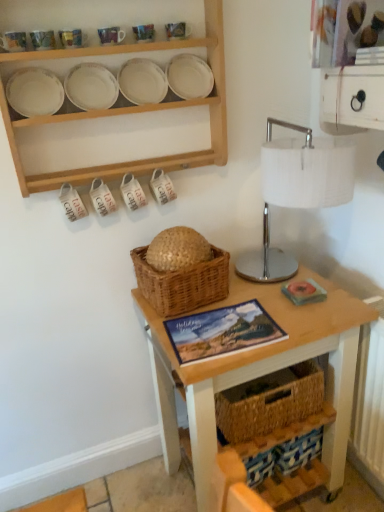
Locate an element on the screen. The width and height of the screenshot is (384, 512). vacant space behind matte paper book at center is located at coordinates (235, 298).